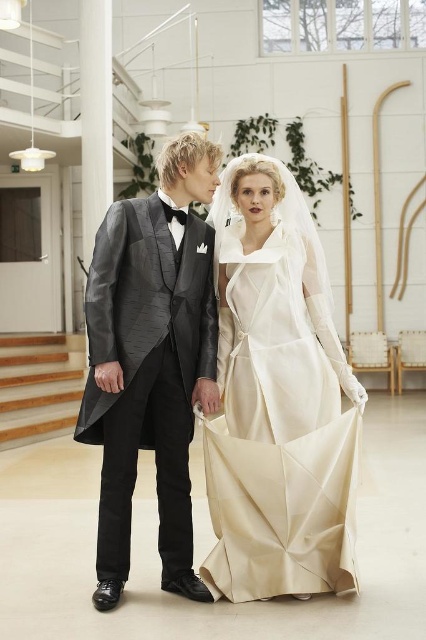
Question: Can you confirm if ivory satin dress at center is bigger than shiny black tuxedo at center?

Choices:
 (A) no
 (B) yes

Answer: (B)

Question: Which point appears closest to the camera in this image?

Choices:
 (A) (247, 298)
 (B) (132, 468)

Answer: (B)

Question: Is ivory satin dress at center wider than shiny black tuxedo at center?

Choices:
 (A) no
 (B) yes

Answer: (B)

Question: Which of the following is the closest to the observer?

Choices:
 (A) (166, 177)
 (B) (250, 436)

Answer: (A)

Question: Is ivory satin dress at center positioned in front of shiny black tuxedo at center?

Choices:
 (A) yes
 (B) no

Answer: (B)

Question: Which point is closer to the camera taking this photo?

Choices:
 (A) (184, 180)
 (B) (249, 198)

Answer: (A)